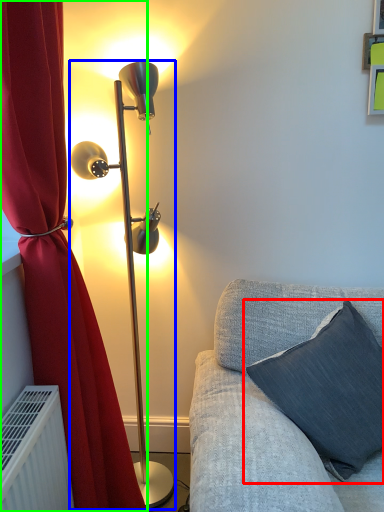
Question: Which object is the closest to the pillow (highlighted by a red box)? Choose among these: lamp (highlighted by a blue box) or curtain (highlighted by a green box).

Choices:
 (A) lamp
 (B) curtain

Answer: (B)